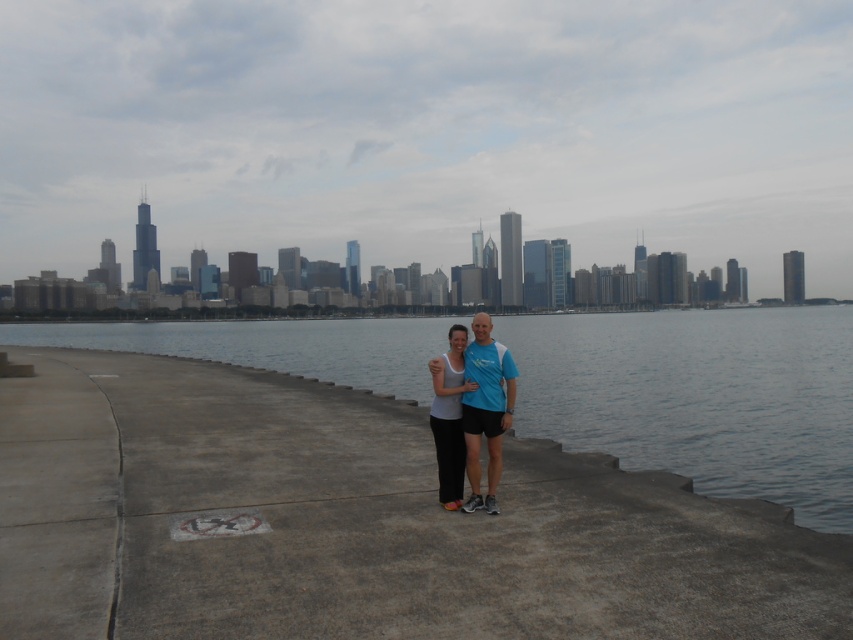
Which is in front, point (585, 433) or point (512, 380)?

Point (512, 380) is more forward.

Does clear water at center appear under blue fabric shirt at center?

Incorrect, clear water at center is not positioned below blue fabric shirt at center.

You are a GUI agent. You are given a task and a screenshot of the screen. Output one action in this format:
    pyautogui.click(x=<x>, y=<y>)
    Task: Click on the clear water at center
    The height and width of the screenshot is (640, 853).
    Given the screenshot: What is the action you would take?
    pyautogui.click(x=700, y=397)

Does clear water at center appear under white matte tank top at center?

Incorrect, clear water at center is not positioned below white matte tank top at center.

Does clear water at center appear on the left side of white matte tank top at center?

No, clear water at center is not to the left of white matte tank top at center.

Is point (517, 428) farther from camera compared to point (436, 451)?

Yes, it is behind point (436, 451).

Where is `clear water at center`? The image size is (853, 640). clear water at center is located at coordinates click(x=700, y=397).

Which of these two, blue fabric shirt at center or white matte tank top at center, stands shorter?

With less height is white matte tank top at center.

Is blue fabric shirt at center to the left of white matte tank top at center from the viewer's perspective?

In fact, blue fabric shirt at center is to the right of white matte tank top at center.

Is point (508, 417) positioned after point (444, 381)?

That is False.

The height and width of the screenshot is (640, 853). What are the coordinates of `blue fabric shirt at center` in the screenshot? It's located at (486, 408).